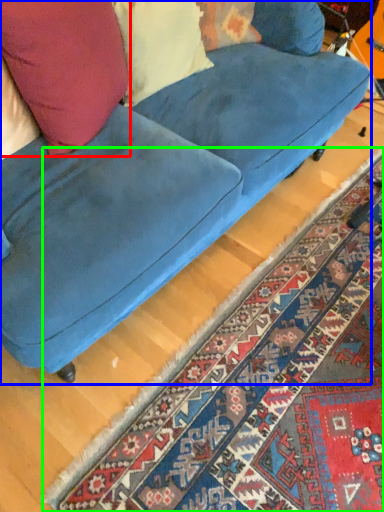
Question: Which is nearer to the throw pillow (highlighted by a red box)? studio couch (highlighted by a blue box) or mat (highlighted by a green box).

Choices:
 (A) studio couch
 (B) mat

Answer: (A)